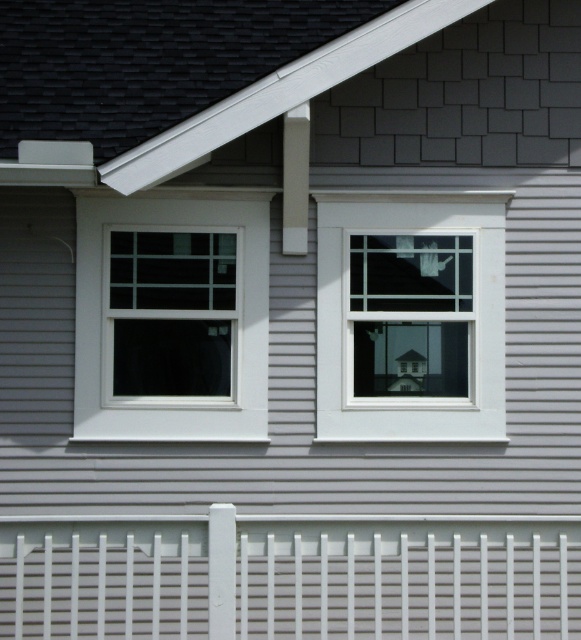
Looking at this image, you are standing in front of the house and notice a point at coordinates (410,316). What object is located at that point?

The white glass window at center is located at point (410,316).

You are a painter who needs to decide which area to paint first. You have a limited amount of white paint. The white plastic fence at lower center and the white matte window at left both need touchups. Based on their sizes, which one requires more paint?

The white plastic fence at lower center requires more paint because it is larger in size than the white matte window at left.

You are standing in front of the house and notice the white glass window at center. Can you determine its exact position relative to the house?

The white glass window at center is located at point coordinates of (x=410, y=316), which places it near the center of the house exterior.